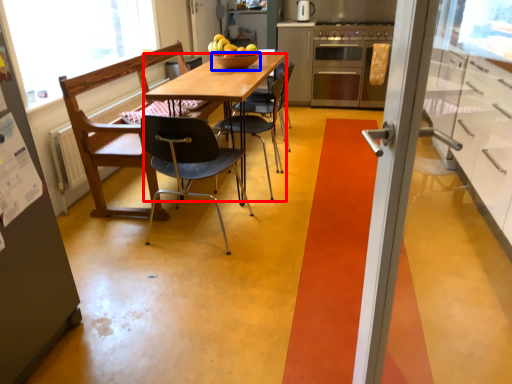
Question: Which object is closer to the camera taking this photo, desk (highlighted by a red box) or bowl (highlighted by a blue box)?

Choices:
 (A) desk
 (B) bowl

Answer: (A)